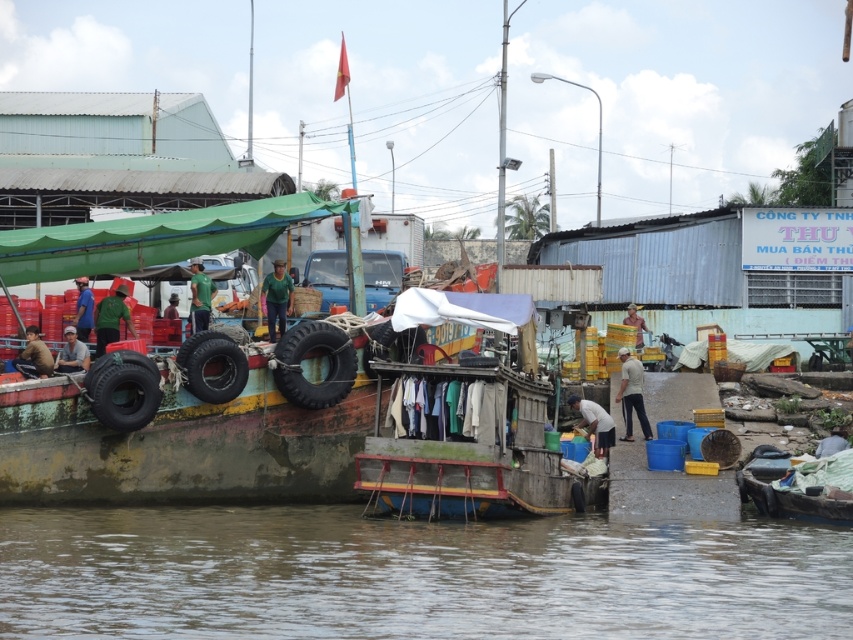
You are a customer at the riverside market and want to board the wooden boat at lower right. However, you notice the matte black shirt at left is hanging near the boat. Can the boat still accommodate you if the shirt takes up space?

The wooden boat at lower right is narrower than the matte black shirt at left, so it might not have enough space to accommodate you if the shirt is taking up space.